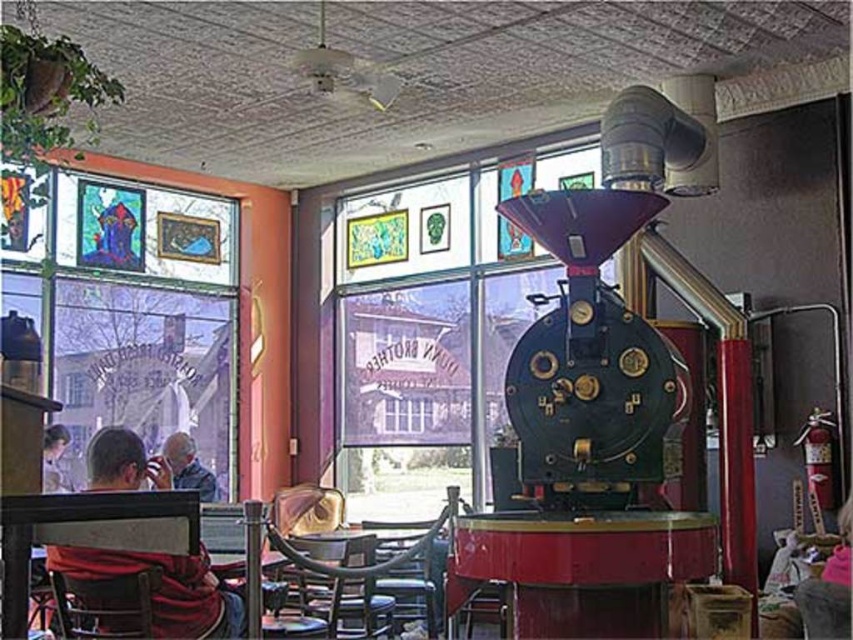
Between point (561, 241) and point (850, 524), which one is positioned behind?

Point (850, 524)

Can you confirm if shiny dark blue metal coffee grinder at center is thinner than pink fabric at lower right?

Incorrect, shiny dark blue metal coffee grinder at center's width is not less than pink fabric at lower right's.

Who is more forward, (607, 493) or (817, 627)?

Point (607, 493) is more forward.

Identify the location of shiny dark blue metal coffee grinder at center. (590, 362).

Is red sweater at left closer to camera compared to gray fabric jacket at lower left?

Yes, it is.

Who is more distant from viewer, [138,483] or [180,472]?

The point [180,472] is behind.

What do you see at coordinates (164, 588) in the screenshot?
I see `red sweater at left` at bounding box center [164, 588].

Identify the location of red sweater at left. The width and height of the screenshot is (853, 640). (164, 588).

How far apart are wooden chair at lower left and pink fabric at lower right?

They are 3.16 meters apart.

Looking at this image, who is more forward, (78, 589) or (849, 538)?

Positioned in front is point (78, 589).

Find the location of a particular element. The image size is (853, 640). wooden chair at lower left is located at coordinates (105, 604).